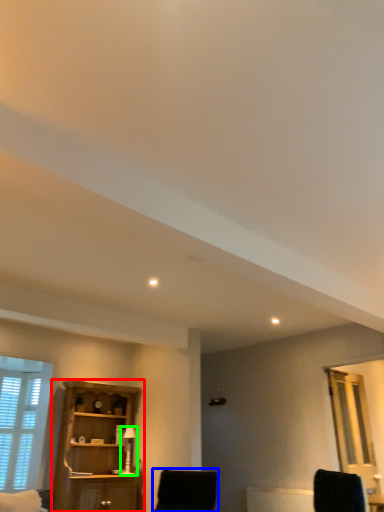
Question: Which object is positioned farthest from cupboard (highlighted by a red box)? Select from chair (highlighted by a blue box) and table lamp (highlighted by a green box).

Choices:
 (A) chair
 (B) table lamp

Answer: (A)